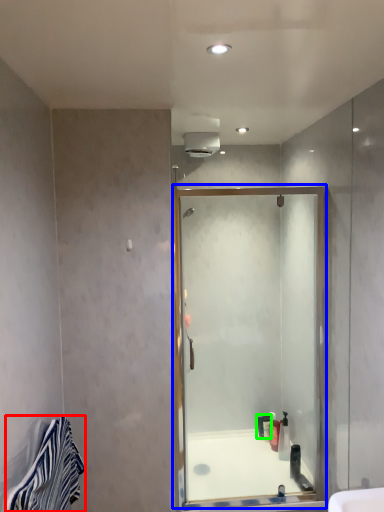
Question: Considering the real-world distances, which object is farthest from material (highlighted by a red box)? screen door (highlighted by a blue box) or toiletry (highlighted by a green box)?

Choices:
 (A) screen door
 (B) toiletry

Answer: (B)